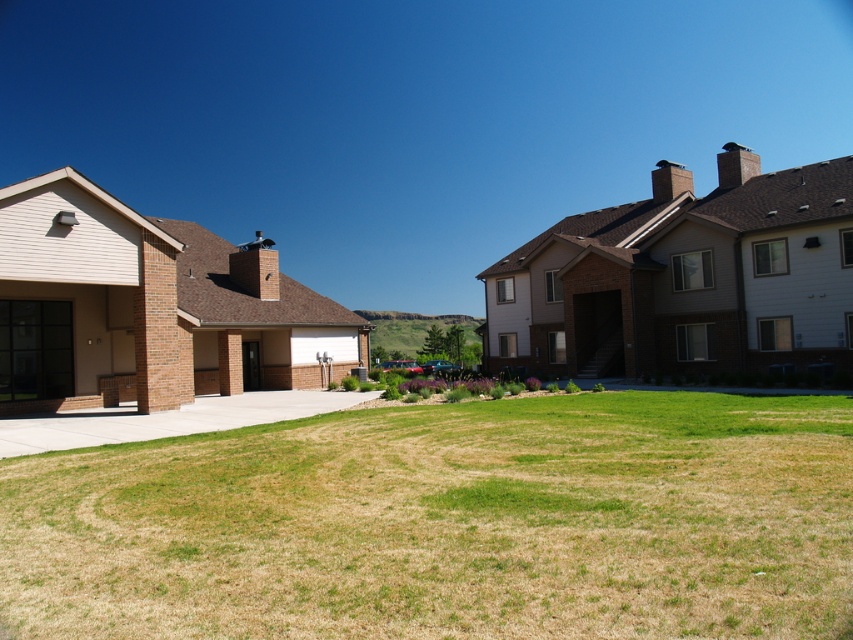
The height and width of the screenshot is (640, 853). What do you see at coordinates (685, 278) in the screenshot? I see `brown wood garage at right` at bounding box center [685, 278].

Identify the location of brown wood garage at right. (685, 278).

What do you see at coordinates (685, 278) in the screenshot? I see `brown wood garage at right` at bounding box center [685, 278].

Locate an element on the screen. brown wood garage at right is located at coordinates (685, 278).

Is point (573, 280) farther from camera compared to point (305, 413)?

Yes.

Looking at this image, between brown wood garage at right and concrete at center, which one appears on the right side from the viewer's perspective?

brown wood garage at right is more to the right.

At what (x,y) coordinates should I click in order to perform the action: click on brown wood garage at right. Please return your answer as a coordinate pair (x, y). Looking at the image, I should click on (685, 278).

Does green grass at center appear on the left side of beige brick garage at left?

No, green grass at center is not to the left of beige brick garage at left.

Does green grass at center have a greater width compared to beige brick garage at left?

No.

Measure the distance between point (711,611) and camera.

4.74 meters

Where is `green grass at center`? The height and width of the screenshot is (640, 853). green grass at center is located at coordinates (447, 524).